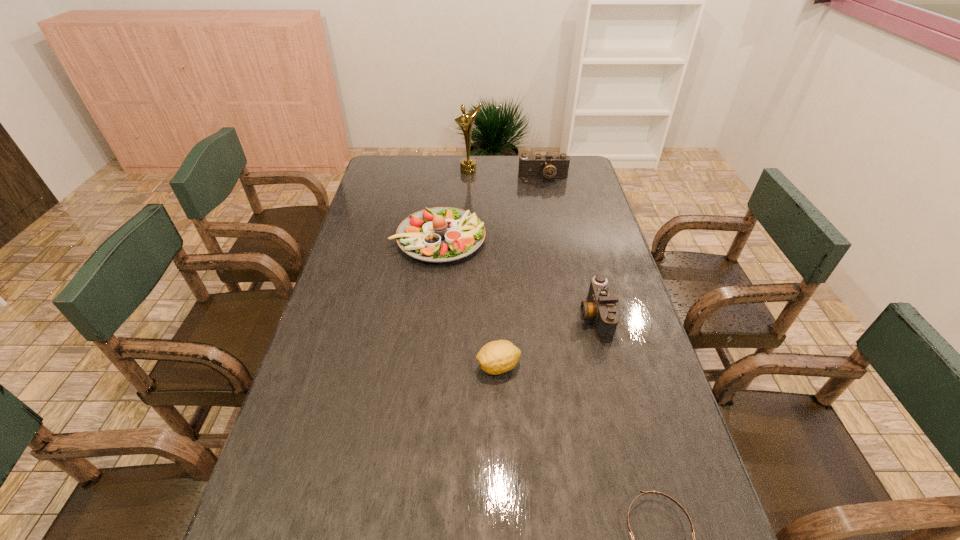
You are a GUI agent. You are given a task and a screenshot of the screen. Output one action in this format:
    pyautogui.click(x=<x>, y=<y>)
    Task: Click on the vacant space at the right edge of the desktop
    The image size is (960, 540).
    Given the screenshot: What is the action you would take?
    click(x=665, y=395)

Identify the location of free spot between the farther camera and the fourth farthest object. The height and width of the screenshot is (540, 960). (569, 247).

Identify the location of unoccupied position between the third farthest object and the award. The height and width of the screenshot is (540, 960). (454, 205).

Identify the location of free space between the second nearest object and the nearer camera. (546, 341).

This screenshot has height=540, width=960. I want to click on vacant point located between the fourth farthest object and the farther camera, so click(x=569, y=247).

Locate an element on the screen. The image size is (960, 540). vacant region between the farther camera and the tallest object is located at coordinates (506, 174).

At what (x,y) coordinates should I click in order to perform the action: click on object that can be found as the fourth closest to the third nearest object. Please return your answer as a coordinate pair (x, y). This screenshot has width=960, height=540. Looking at the image, I should click on (538, 166).

Identify which object is the fifth nearest to the third nearest object. Please provide its 2D coordinates. Your answer should be formatted as a tuple, i.e. [(x, y)], where the tuple contains the x and y coordinates of a point satisfying the conditions above.

[(467, 165)]

This screenshot has width=960, height=540. Identify the location of free space that satisfies the following two spatial constraints: 1. on the front-facing side of the farther camera; 2. at the stem end of the lemon. (581, 366).

What are the coordinates of `free spot that satisfies the following two spatial constraints: 1. on the front-facing side of the farther camera; 2. at the stem end of the lemon` in the screenshot? It's located at point(581,366).